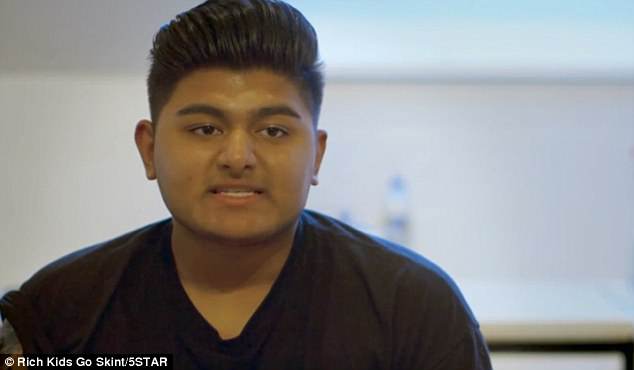
The width and height of the screenshot is (634, 370). I want to click on white wall, so click(75, 182).